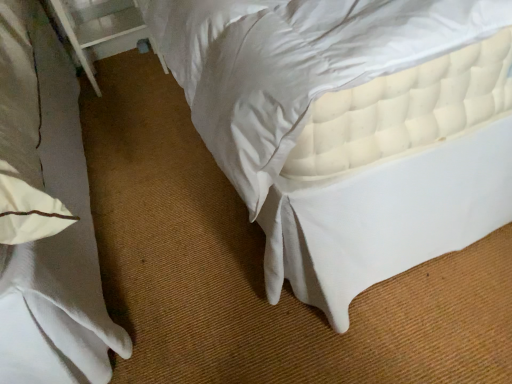
Question: From the image's perspective, is white quilted mattress at upper right positioned above or below white plastic balustrade at upper left?

Choices:
 (A) below
 (B) above

Answer: (A)

Question: In terms of width, does white quilted mattress at upper right look wider or thinner when compared to white plastic balustrade at upper left?

Choices:
 (A) thin
 (B) wide

Answer: (B)

Question: Would you say white quilted mattress at upper right is to the left or to the right of white plastic balustrade at upper left in the picture?

Choices:
 (A) left
 (B) right

Answer: (B)

Question: Visually, is white plastic balustrade at upper left positioned to the left or to the right of white quilted mattress at upper right?

Choices:
 (A) right
 (B) left

Answer: (B)

Question: From the image's perspective, is white plastic balustrade at upper left above or below white quilted mattress at upper right?

Choices:
 (A) above
 (B) below

Answer: (A)

Question: From their relative heights in the image, would you say white plastic balustrade at upper left is taller or shorter than white quilted mattress at upper right?

Choices:
 (A) short
 (B) tall

Answer: (B)

Question: Based on their sizes in the image, would you say white plastic balustrade at upper left is bigger or smaller than white quilted mattress at upper right?

Choices:
 (A) small
 (B) big

Answer: (A)